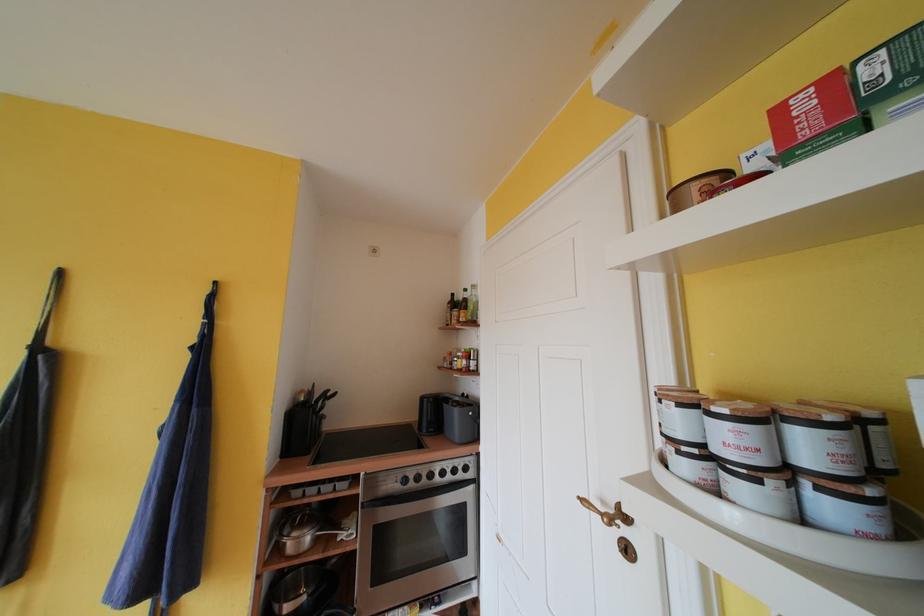
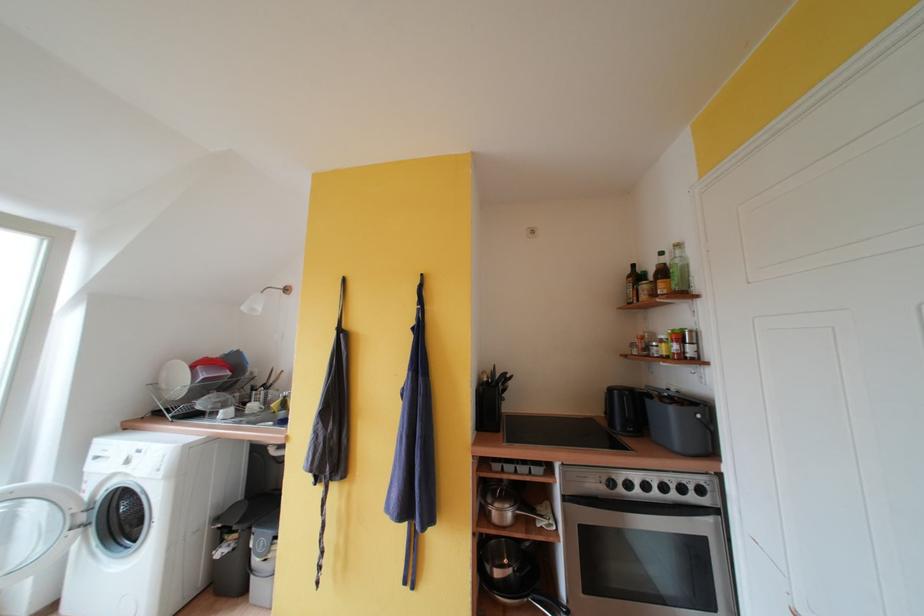
The point at [418,480] is marked in the first image. Where is the corresponding point in the second image?

(626, 485)